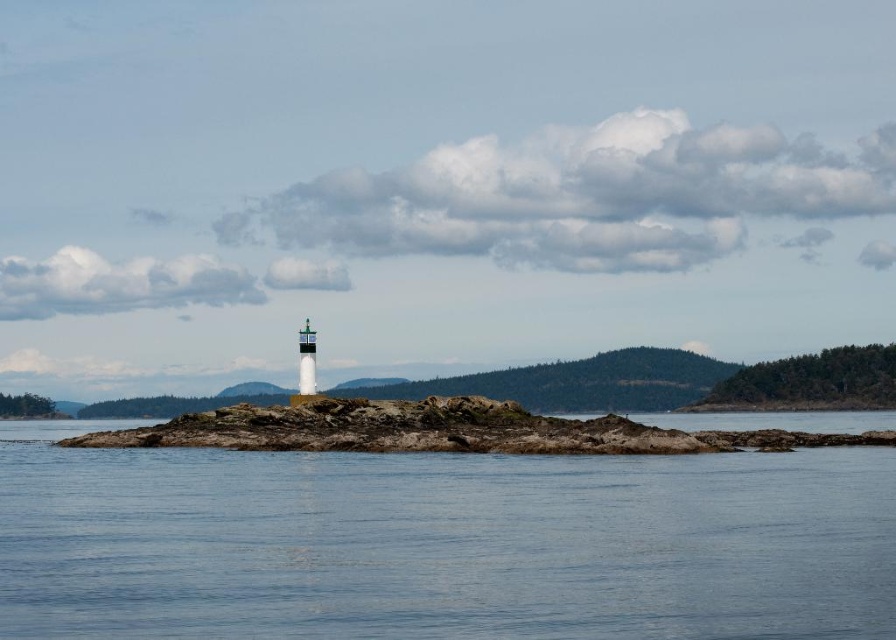
Question: Is clear blue water at center in front of rugged stone island at center?

Choices:
 (A) no
 (B) yes

Answer: (B)

Question: Which of the following is the farthest from the observer?

Choices:
 (A) (418, 609)
 (B) (368, 426)

Answer: (B)

Question: Does clear blue water at center appear on the left side of rugged stone island at center?

Choices:
 (A) no
 (B) yes

Answer: (B)

Question: Which object appears farthest from the camera in this image?

Choices:
 (A) clear blue water at center
 (B) rugged stone island at center

Answer: (B)

Question: Can you confirm if clear blue water at center is positioned to the right of rugged stone island at center?

Choices:
 (A) no
 (B) yes

Answer: (A)

Question: Which of the following is the closest to the observer?

Choices:
 (A) clear blue water at center
 (B) rugged stone island at center

Answer: (A)